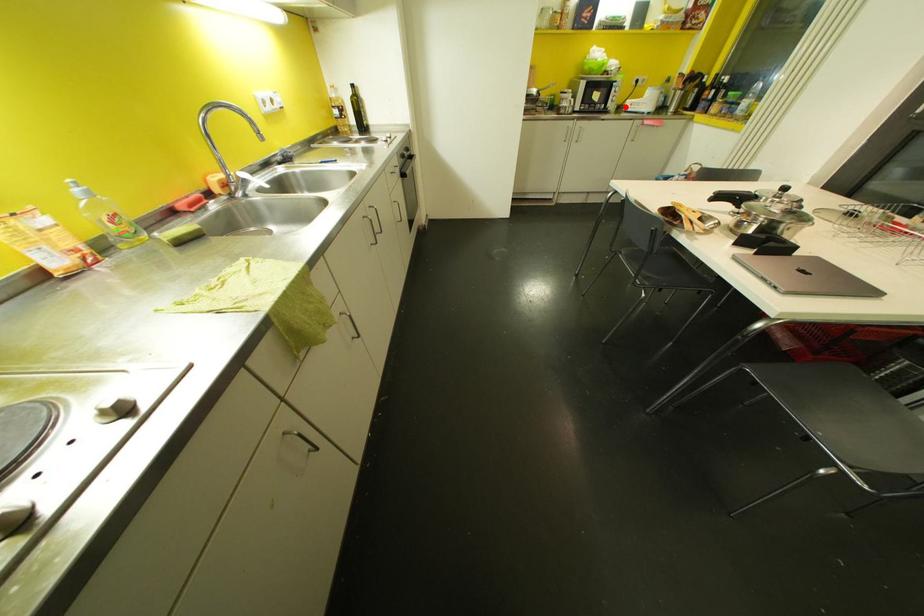
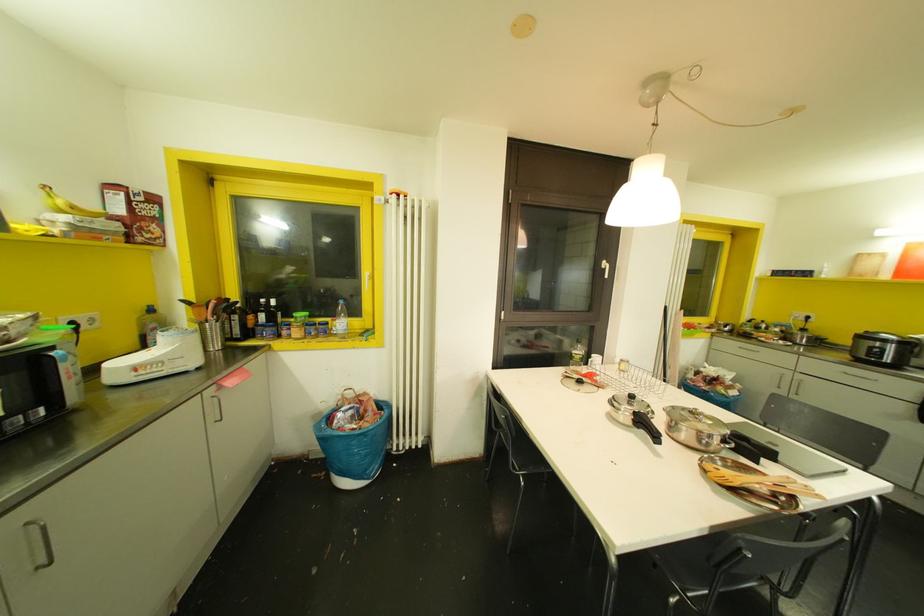
Question: A red point is marked in image1. In image2, is the corresponding 3D point closer to the camera or farther? Reply with the corresponding letter.

Choices:
 (A) The corresponding 3D point is closer.
 (B) The corresponding 3D point is farther.

Answer: (B)